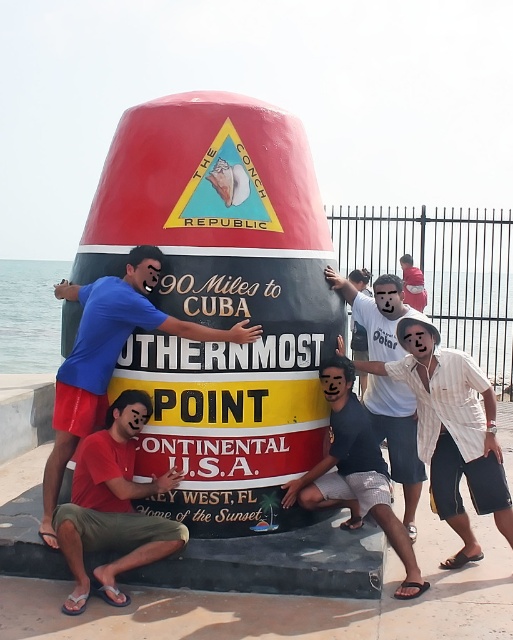
Question: Considering the relative positions of blue t-shirt at lower left and white cotton shirt at upper center in the image provided, where is blue t-shirt at lower left located with respect to white cotton shirt at upper center?

Choices:
 (A) right
 (B) left

Answer: (B)

Question: Which of these objects is positioned closest to the white striped shirt at center?

Choices:
 (A) red matte shirt at lower left
 (B) white cotton shirt at upper center
 (C) blue t-shirt at lower left

Answer: (B)

Question: Does red matte shirt at lower left have a lesser width compared to matte black shorts at lower center?

Choices:
 (A) yes
 (B) no

Answer: (A)

Question: Is white striped shirt at center thinner than blue t-shirt at lower left?

Choices:
 (A) yes
 (B) no

Answer: (A)

Question: Among these points, which one is nearest to the camera?

Choices:
 (A) (388, 380)
 (B) (94, 547)

Answer: (B)

Question: Which of these objects is positioned closest to the white cotton shirt at upper center?

Choices:
 (A) blue t-shirt at lower left
 (B) matte black shorts at lower center

Answer: (B)